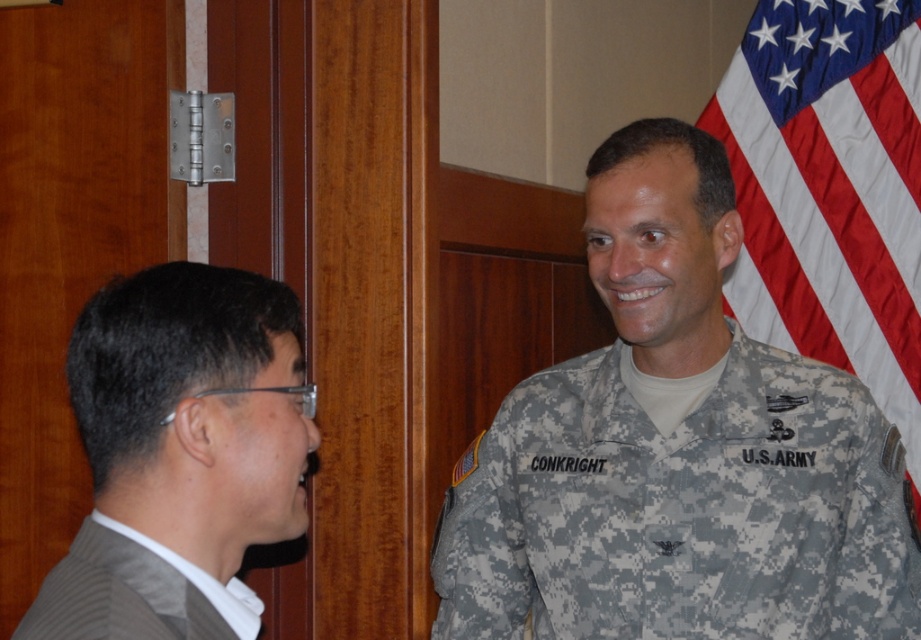
You are organizing a charity event and need to choose a suit for a presentation. You have two options available in the dressing room. The gray suit at left and the gray pleated suit at left. Based on the description, which suit would you recommend for a more formal and professional appearance?

The gray suit at left is larger in size than the gray pleated suit at left. For a more formal and professional appearance, the gray suit at left is recommended as it typically offers a more classic and structured look compared to the pleated version.

Looking at this image, you are a photographer standing in front of the gray suit at left and the american flag at right. You want to take a photo of the flag without the suit blocking it. Can you move to the side to capture the flag without the suit blocking it?

The gray suit at left is in front of the american flag at right, so moving to the side might allow you to capture the flag without the suit blocking it. However, the exact positioning would depend on the angle and distance from the flag.

You are organizing a military ceremony and need to ensure seating arrangements. The camouflage uniform at right and gray suit at left are present. Which person should be seated first according to military protocol, considering their attire?

According to military protocol, the person in the camouflage uniform at right should be seated first because their attire indicates a higher rank or military status compared to the gray suit at left.